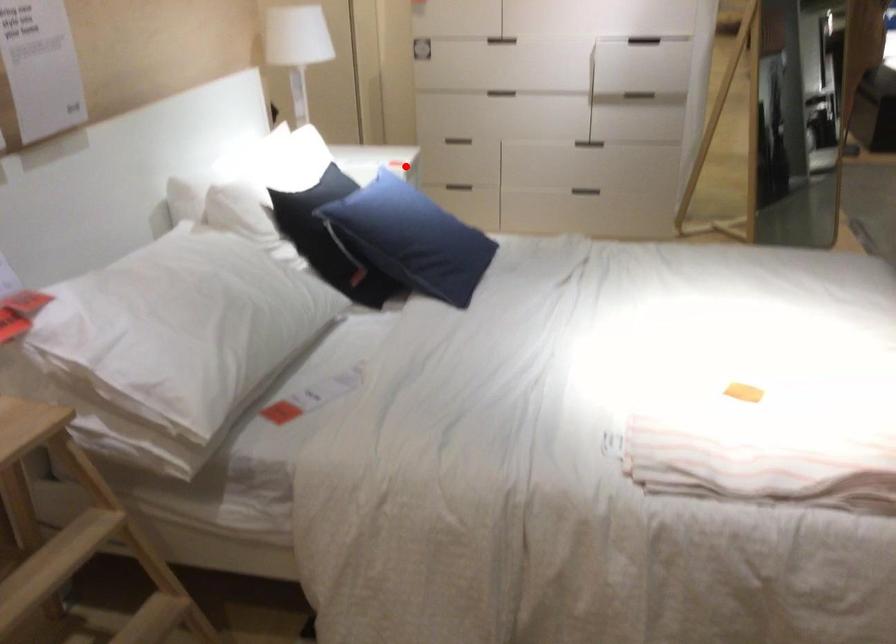
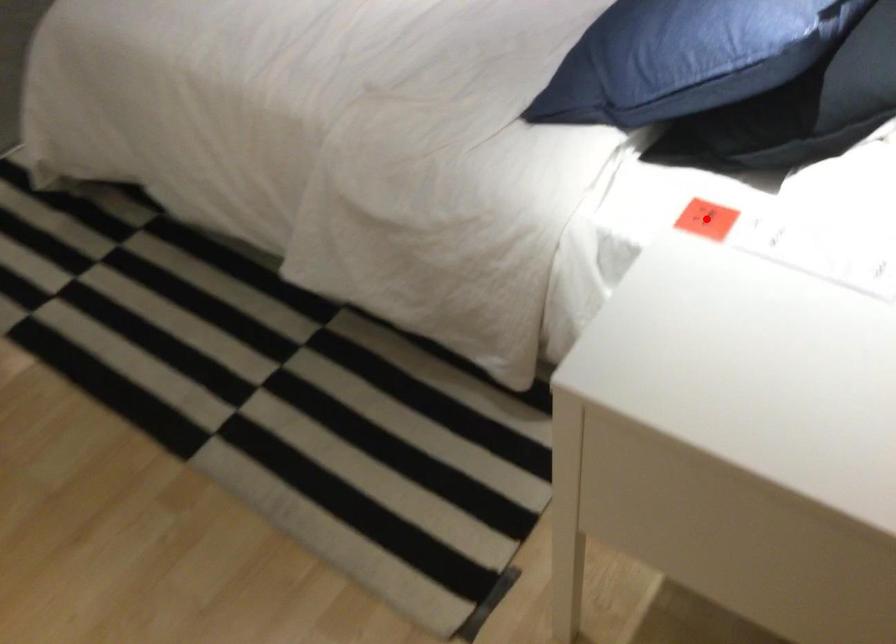
I am providing you with two images of the same scene from different viewpoints. A red point is marked on the first image and another point is marked on the second image. Are the points marked in image1 and image2 representing the same 3D position?

Yes